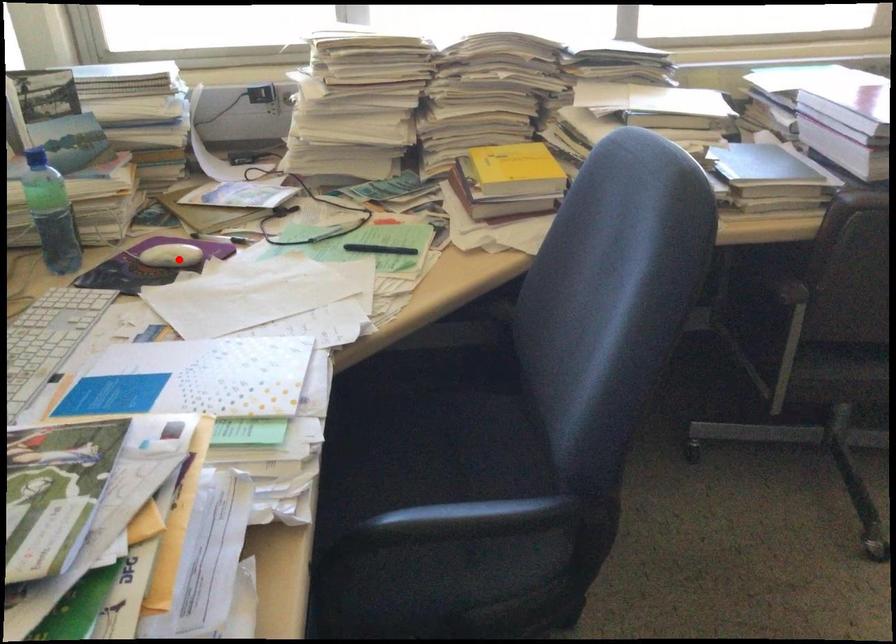
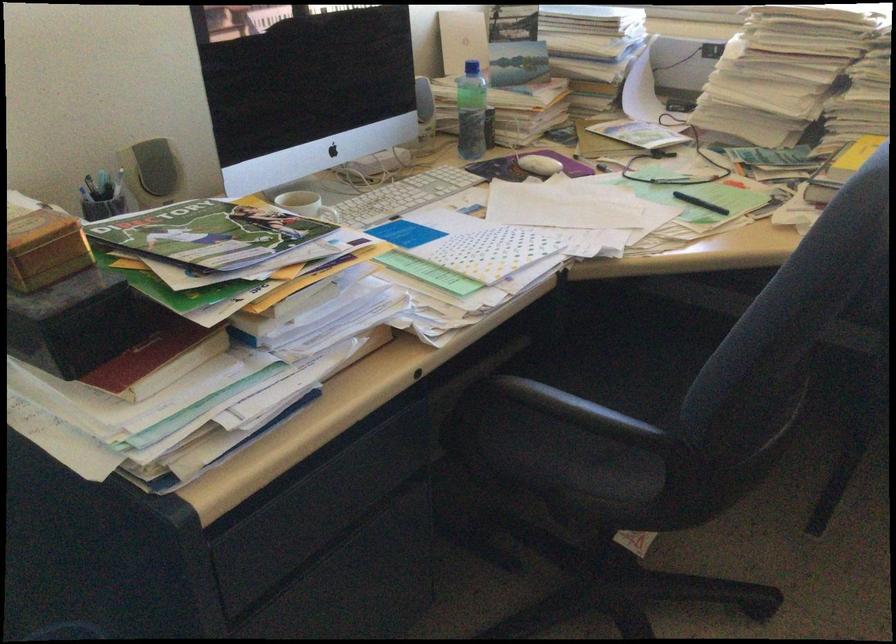
Question: I am providing you with two images of the same scene from different viewpoints. Image1 has a red point marked. In image2, the corresponding 3D location appears at what relative position? Reply with the corresponding letter.

Choices:
 (A) Closer
 (B) Farther

Answer: (B)